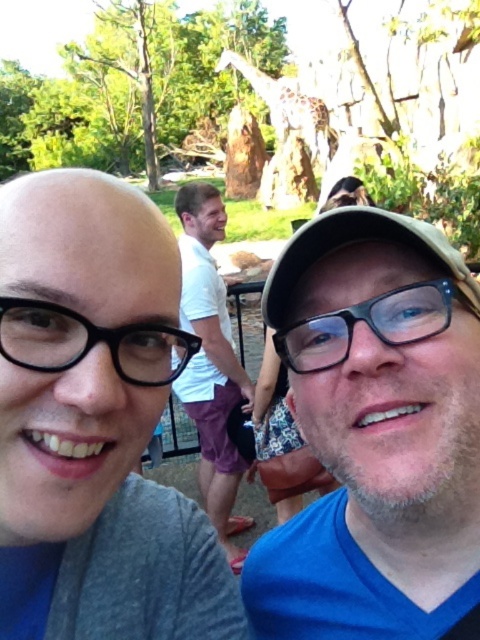
Measure the distance between white cotton shirt at center and camera.

20.36 feet

Can you confirm if white cotton shirt at center is wider than black plastic glasses at center?

In fact, white cotton shirt at center might be narrower than black plastic glasses at center.

Measure the distance between white cotton shirt at center and camera.

A distance of 6.21 meters exists between white cotton shirt at center and camera.

Identify the location of white cotton shirt at center. The image size is (480, 640). (211, 362).

Is gray matte shirt at upper left to the right of blue fabric shirt at center from the viewer's perspective?

In fact, gray matte shirt at upper left is to the left of blue fabric shirt at center.

Which is above, gray matte shirt at upper left or blue fabric shirt at center?

gray matte shirt at upper left

What are the coordinates of `gray matte shirt at upper left` in the screenshot? It's located at (95, 422).

Is point (447, 385) behind point (47, 333)?

Yes, point (447, 385) is farther from viewer.

Between point (395, 282) and point (73, 333), which one is positioned in front?

Point (73, 333) is more forward.

I want to click on blue fabric shirt at center, so click(x=374, y=433).